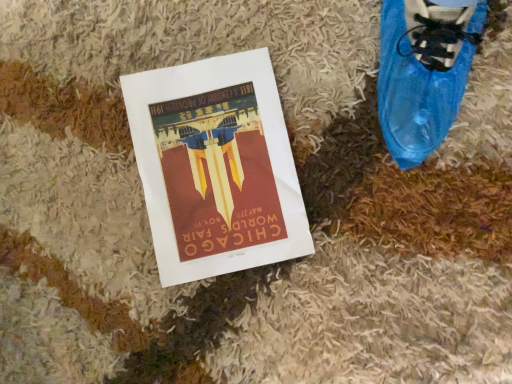
What do you see at coordinates (216, 167) in the screenshot?
I see `matte paper poster at center` at bounding box center [216, 167].

Locate an element on the screen. The image size is (512, 384). matte paper poster at center is located at coordinates (216, 167).

Identify the location of matte paper poster at center. This screenshot has width=512, height=384. (216, 167).